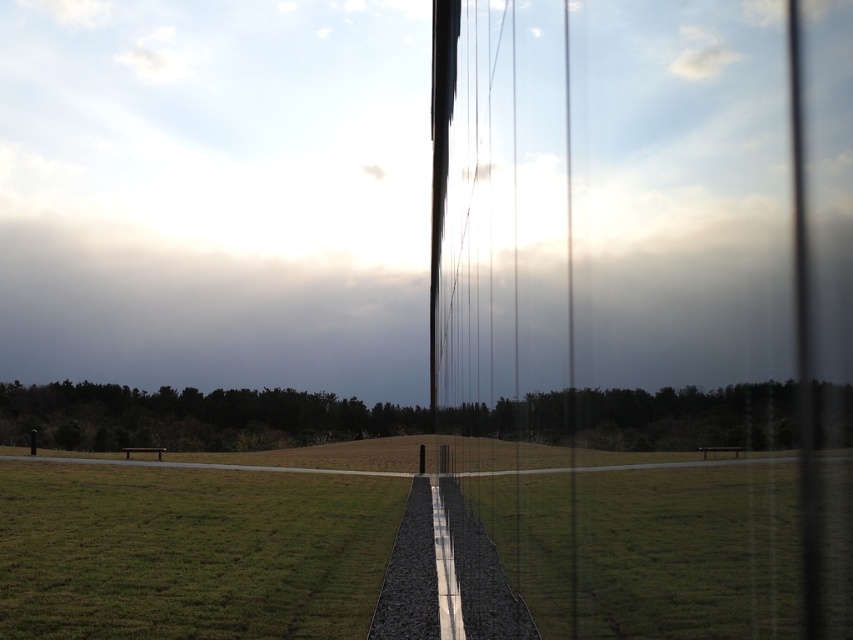
You are a passenger on a train and notice the transparent glass train window at center and the green grass at center. Which object is closer to you?

The transparent glass train window at center is closer to you since it is positioned over the green grass at center, indicating it is in front of the grass.

You are standing in front of the reflective surface and see the green grass at lower left and the green grass at center. Which area of green grass is bigger in size?

The green grass at lower left has a larger size compared to the green grass at center, so the green grass at lower left is bigger in size.